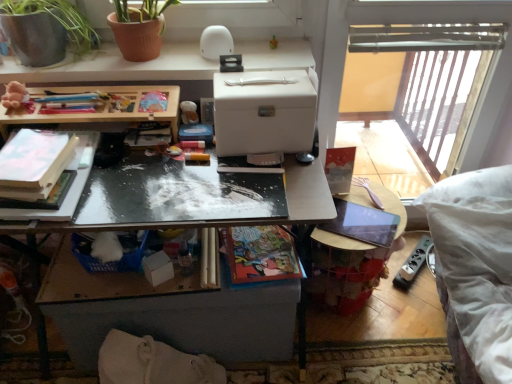
Question: Is matte paper book at center, which is the 1th book from right to left, smaller than matte white book at left, the third book positioned from the right?

Choices:
 (A) no
 (B) yes

Answer: (A)

Question: Considering the relative positions of matte paper book at center, which is the 1th book from right to left, and matte white book at left, the third book positioned from the right, in the image provided, is matte paper book at center, which is the 1th book from right to left, to the right of matte white book at left, the third book positioned from the right, from the viewer's perspective?

Choices:
 (A) yes
 (B) no

Answer: (A)

Question: Is matte paper book at center, which is the 1th book from right to left, closer to camera compared to matte white book at left, the third book positioned from the right?

Choices:
 (A) yes
 (B) no

Answer: (B)

Question: Considering the relative sizes of matte paper book at center, which is the third book from left to right, and matte white book at left, arranged as the first book when viewed from the left, in the image provided, is matte paper book at center, which is the third book from left to right, wider than matte white book at left, arranged as the first book when viewed from the left,?

Choices:
 (A) no
 (B) yes

Answer: (B)

Question: Does matte paper book at center, which is the 1th book from right to left, have a larger size compared to matte white book at left, arranged as the first book when viewed from the left?

Choices:
 (A) yes
 (B) no

Answer: (A)

Question: Considering their positions, is fluffy beige teddy bear at upper left, the first toy positioned from the front, located in front of or behind wooden table at center, which ranks as the first table in bottom-to-top order?

Choices:
 (A) behind
 (B) front

Answer: (B)

Question: Considering the positions of fluffy beige teddy bear at upper left, which ranks as the second toy in back-to-front order, and wooden table at center, which ranks as the first table in bottom-to-top order, in the image, is fluffy beige teddy bear at upper left, which ranks as the second toy in back-to-front order, bigger or smaller than wooden table at center, which ranks as the first table in bottom-to-top order,?

Choices:
 (A) big
 (B) small

Answer: (B)

Question: From the image's perspective, is fluffy beige teddy bear at upper left, the first toy positioned from the front, located above or below wooden table at center, which ranks as the first table in bottom-to-top order?

Choices:
 (A) above
 (B) below

Answer: (A)

Question: From their relative heights in the image, would you say fluffy beige teddy bear at upper left, the first toy positioned from the front, is taller or shorter than wooden table at center, which ranks as the first table in bottom-to-top order?

Choices:
 (A) tall
 (B) short

Answer: (B)

Question: Looking at their shapes, would you say terracotta clay pot at upper left is wider or thinner than wooden table at center, marked as the 2th table in a top-to-bottom arrangement?

Choices:
 (A) thin
 (B) wide

Answer: (A)

Question: Is terracotta clay pot at upper left to the left or to the right of wooden table at center, which ranks as the first table in bottom-to-top order, in the image?

Choices:
 (A) left
 (B) right

Answer: (A)

Question: Is terracotta clay pot at upper left bigger or smaller than wooden table at center, which ranks as the first table in bottom-to-top order?

Choices:
 (A) big
 (B) small

Answer: (B)

Question: Considering the positions of terracotta clay pot at upper left and wooden table at center, which ranks as the first table in bottom-to-top order, in the image, is terracotta clay pot at upper left taller or shorter than wooden table at center, which ranks as the first table in bottom-to-top order,?

Choices:
 (A) tall
 (B) short

Answer: (B)

Question: Is white matte desk at upper center to the left or to the right of terracotta clay pot at upper left in the image?

Choices:
 (A) left
 (B) right

Answer: (B)

Question: Considering their positions, is white matte desk at upper center located in front of or behind terracotta clay pot at upper left?

Choices:
 (A) behind
 (B) front

Answer: (A)